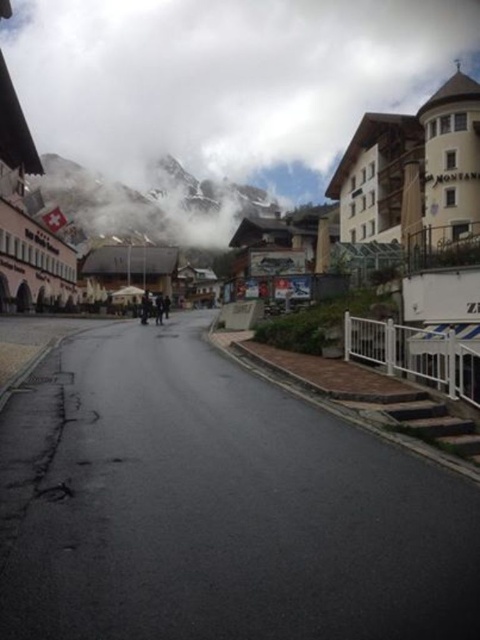
You are a drone operator trying to capture a photo of the street scene with the white fluffy cloud at upper center. If you position your drone at the center of the road, will the cloud be visible in your shot?

The white fluffy cloud at upper center is located at point (228, 77), so yes, the cloud will be visible in the shot as it is positioned at the upper center of the image.

You are a photographer planning to capture the entire snowy rocky mountain at upper center in one shot. However, you notice the white fluffy cloud at upper center might block part of the mountain. Based on the scene, can you determine if the cloud will obscure the mountain in your photo?

The white fluffy cloud at upper center occupies less space than snowy rocky mountain at upper center, so it will not fully obscure the mountain. However, it may partially block a small portion of the mountain depending on their exact positions.

You are a hiker who wants to take a photo of the snowy rocky mountain at upper center while wearing the dark gray fabric jacket at center. Since you have a camera with a 50mm lens, which has a standard field of view, will you be able to capture both the jacket and the mountain in the same frame without moving your position?

The snowy rocky mountain at upper center and dark gray fabric jacket at center are 1850.12 feet apart. With a 50mm lens, the maximum distance between objects that can be captured in the same frame is about 150 feet. Since 1850.12 feet exceeds this limit, you won t be able to capture both in the same frame without moving closer or using a wider lens.